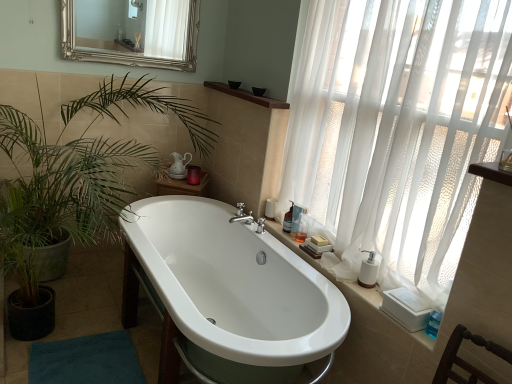
The width and height of the screenshot is (512, 384). Identify the location of free space above teal fabric bath mat at lower left (from a real-world perspective). (88, 360).